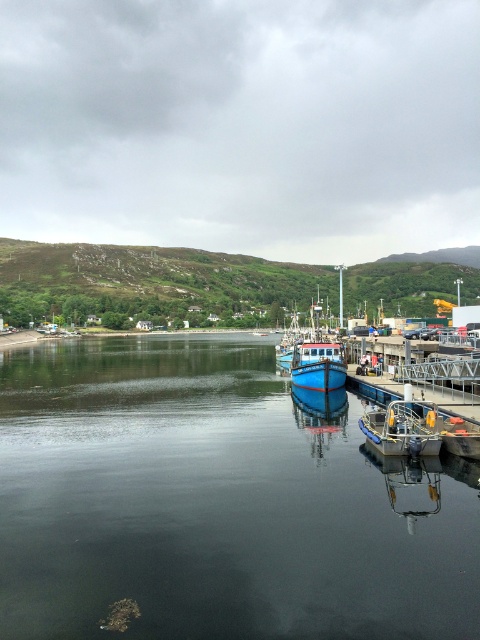
Question: Which point is farther to the camera?

Choices:
 (A) blue matte boat at center
 (B) metallic blue boat at center

Answer: (A)

Question: Considering the real-world distances, which object is closest to the blue matte boat at center?

Choices:
 (A) smooth dark water at center
 (B) metallic blue boat at center

Answer: (A)

Question: Which is nearer to the metallic blue boat at center?

Choices:
 (A) blue matte boat at center
 (B) smooth dark water at center

Answer: (A)

Question: Can you confirm if smooth dark water at center is positioned above blue matte boat at center?

Choices:
 (A) yes
 (B) no

Answer: (B)

Question: Is metallic blue boat at center further to camera compared to blue matte boat at center?

Choices:
 (A) yes
 (B) no

Answer: (B)

Question: Is smooth dark water at center below metallic blue boat at center?

Choices:
 (A) yes
 (B) no

Answer: (A)